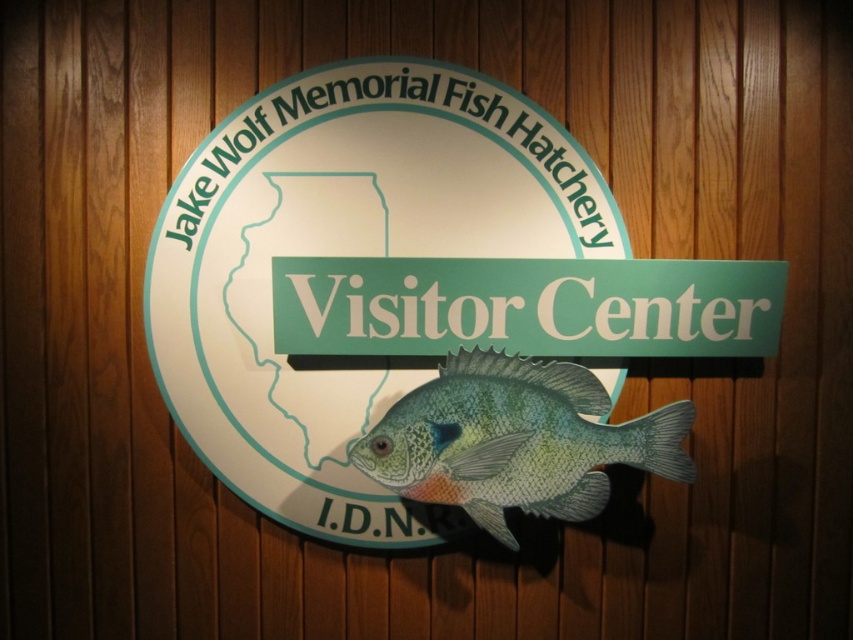
Question: Which point is closer to the camera taking this photo?

Choices:
 (A) (426, 380)
 (B) (607, 493)

Answer: (B)

Question: Does matte plastic sign at center appear on the left side of shiny blue fish at center?

Choices:
 (A) no
 (B) yes

Answer: (B)

Question: Is the position of matte plastic sign at center more distant than that of shiny blue fish at center?

Choices:
 (A) yes
 (B) no

Answer: (A)

Question: Is matte plastic sign at center thinner than shiny blue fish at center?

Choices:
 (A) no
 (B) yes

Answer: (A)